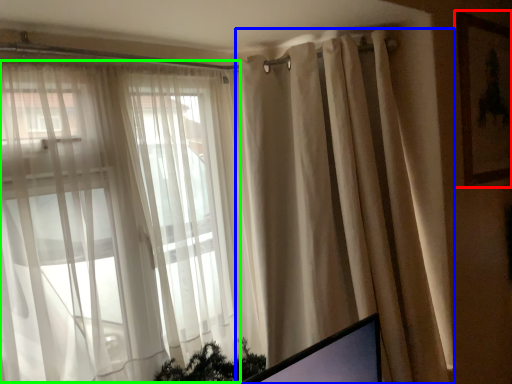
Question: Based on their relative distances, which object is nearer to picture frame (highlighted by a red box)? Choose from curtain (highlighted by a blue box) and bay window (highlighted by a green box).

Choices:
 (A) curtain
 (B) bay window

Answer: (A)